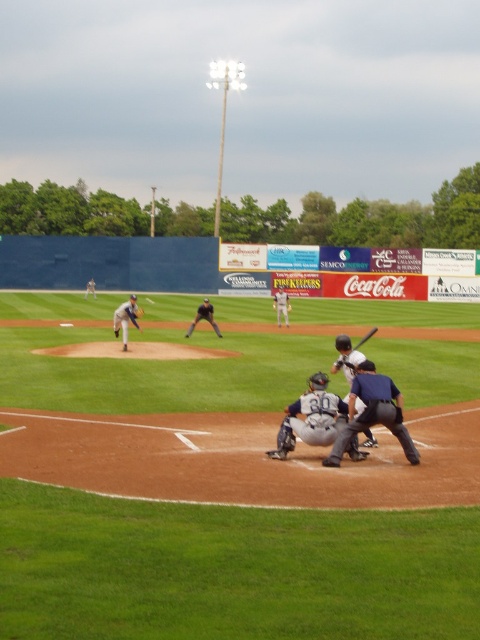
You are a spectator at the baseball game and want to take a photo of both the white jersey baseball player at center and the white uniformed player at center. Which player should you focus on first if you want to capture them both in the same frame without zooming in or out?

The white jersey baseball player at center is much taller than the white uniformed player at center, so you should focus on the white jersey baseball player at center first to ensure they are fully in frame.

You are standing at home plate and want to throw a ball to a teammate. You have two options for throwing the ball to your teammate, either to point A at point (278, 323) or point B at point (85, 288). Which point is closer to you?

Point A at point (278, 323) is closer to you because it is closer to the viewer than point B at point (85, 288).